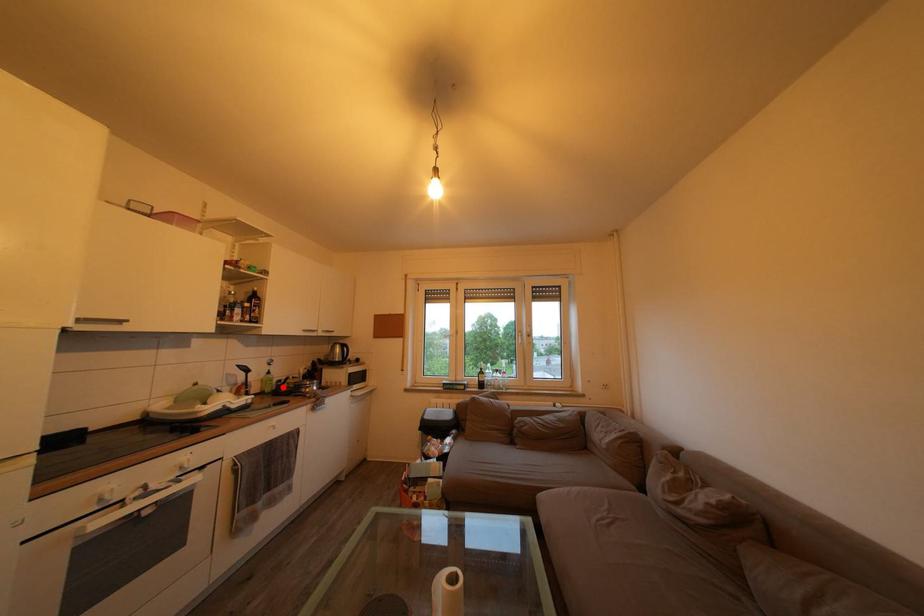
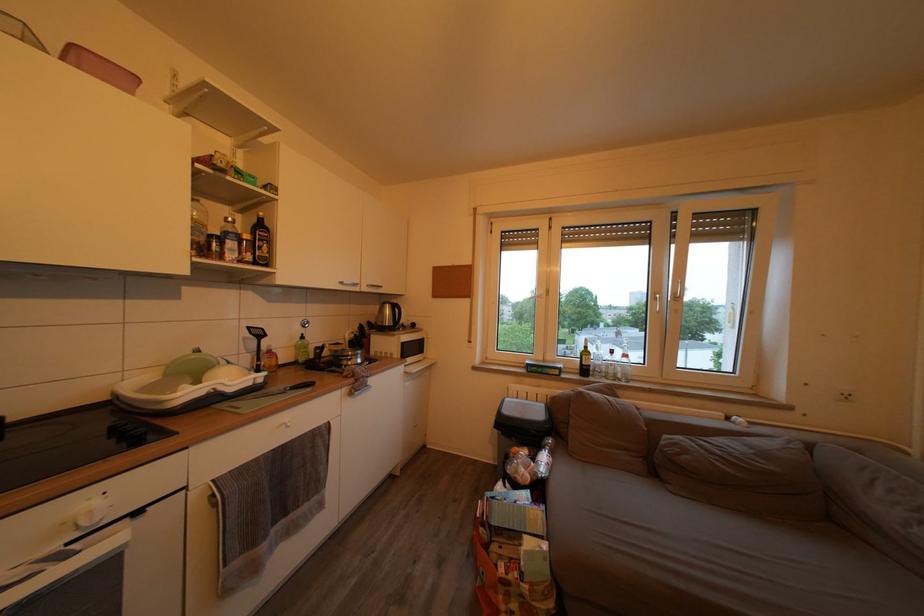
The point at the highlighted location is marked in the first image. Where is the corresponding point in the second image?

(320, 353)